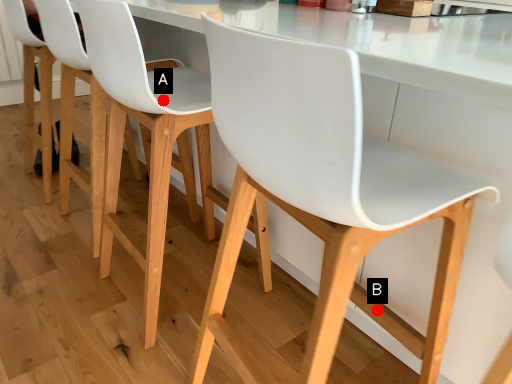
Question: Two points are circled on the image, labeled by A and B beside each circle. Which point is further to the camera?

Choices:
 (A) A is further
 (B) B is further

Answer: (A)